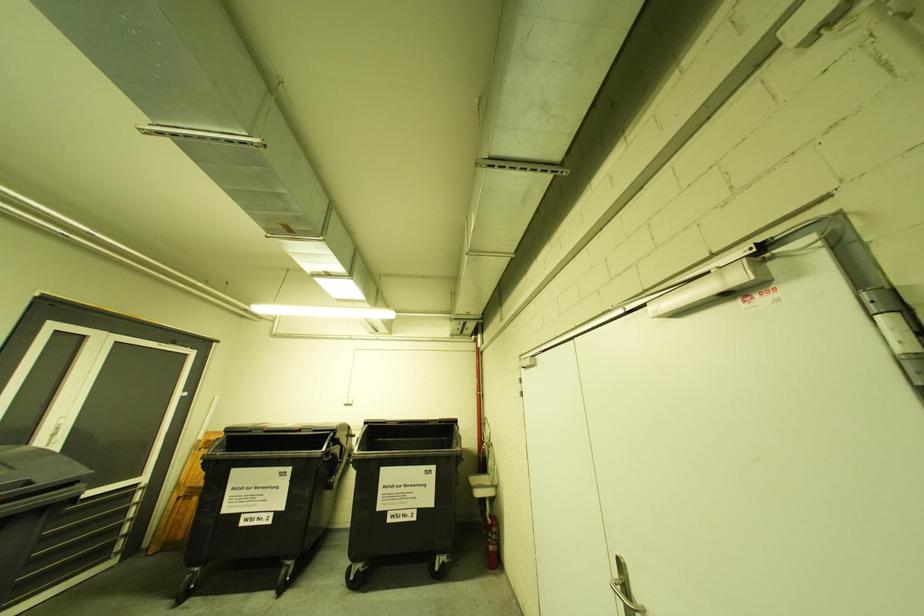
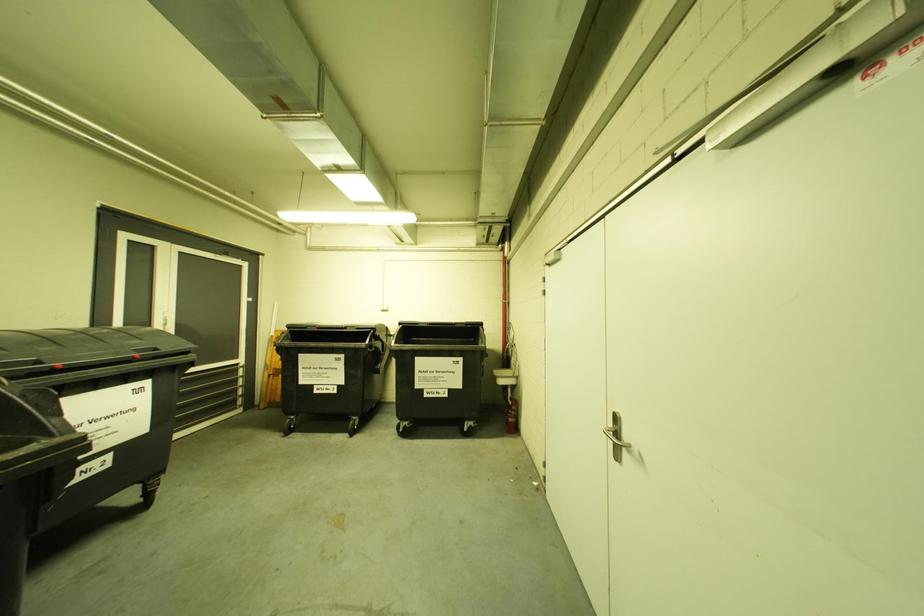
Question: What movement of the cameraman would produce the second image?

Choices:
 (A) Left
 (B) Right
 (C) Forward
 (D) Backward

Answer: (B)